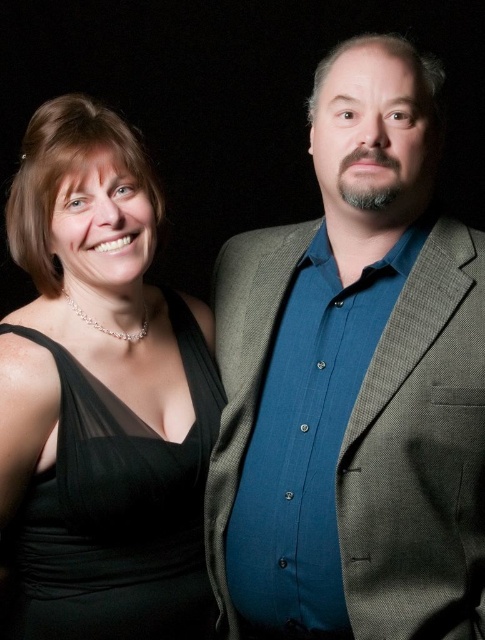
Who is lower down, textured gray blazer at center or black satin dress at left?

black satin dress at left

Describe the element at coordinates (355, 381) in the screenshot. I see `textured gray blazer at center` at that location.

Identify the location of textured gray blazer at center. (355, 381).